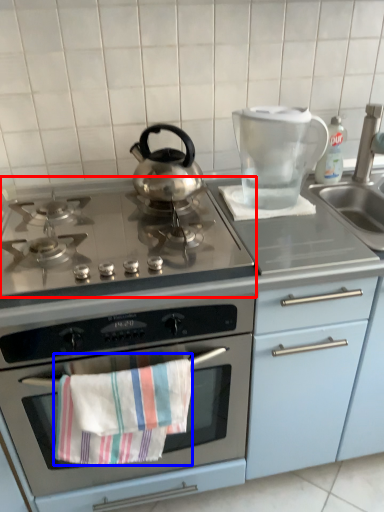
Question: Which of the following is the farthest to the observer, gas stove (highlighted by a red box) or beach towel (highlighted by a blue box)?

Choices:
 (A) gas stove
 (B) beach towel

Answer: (B)